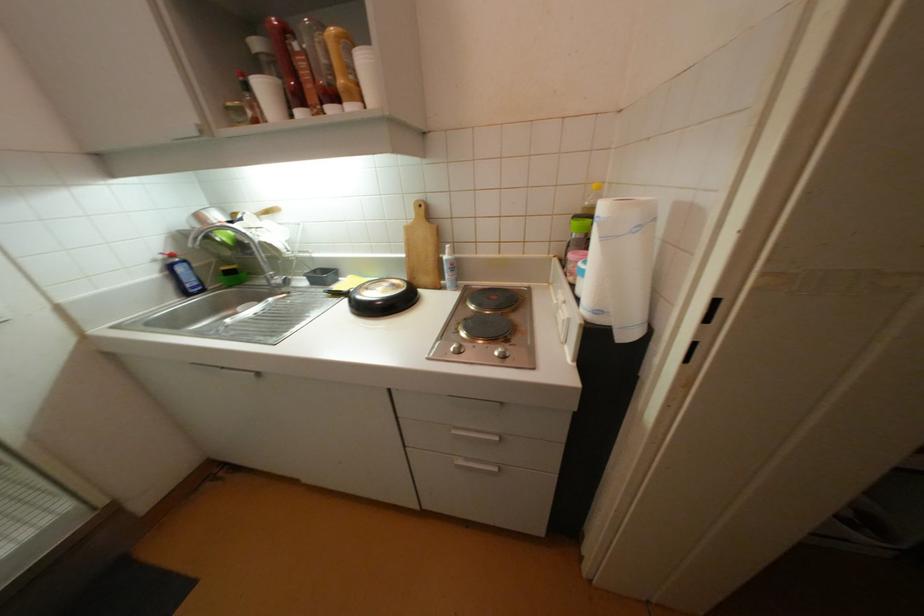
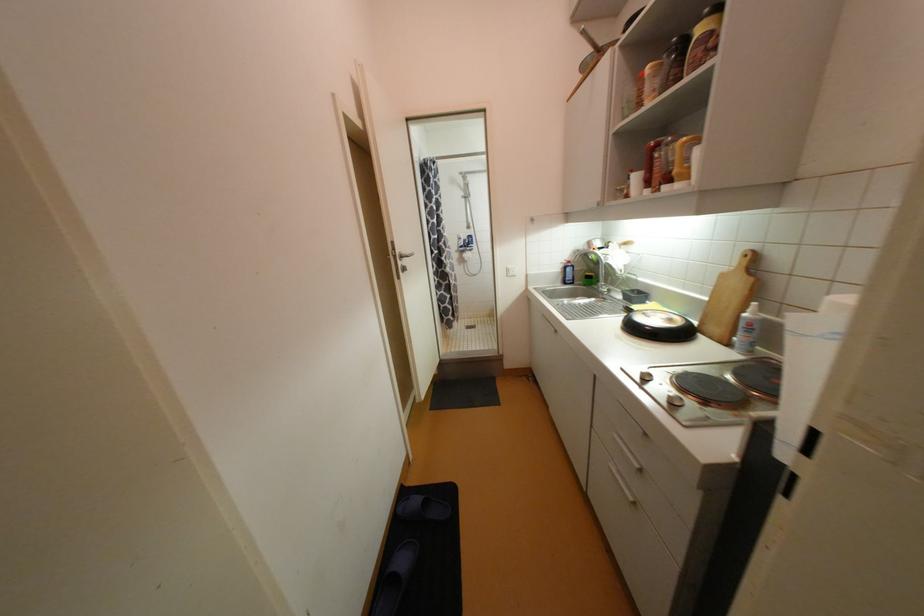
In the second image, find the point that corresponds to (341,100) in the first image.

(675, 180)